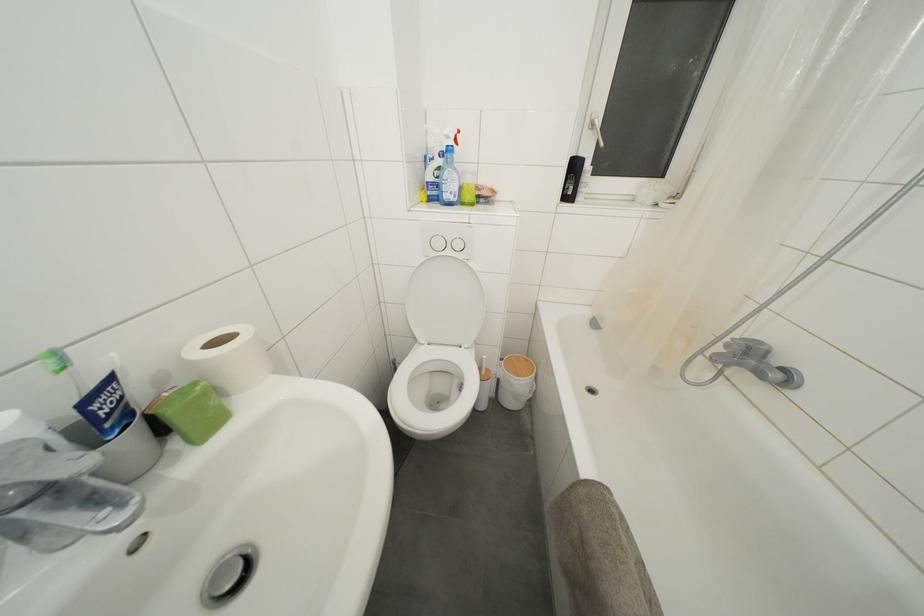
Find the location of a particular element. spray bottle trigger is located at coordinates (450, 136).